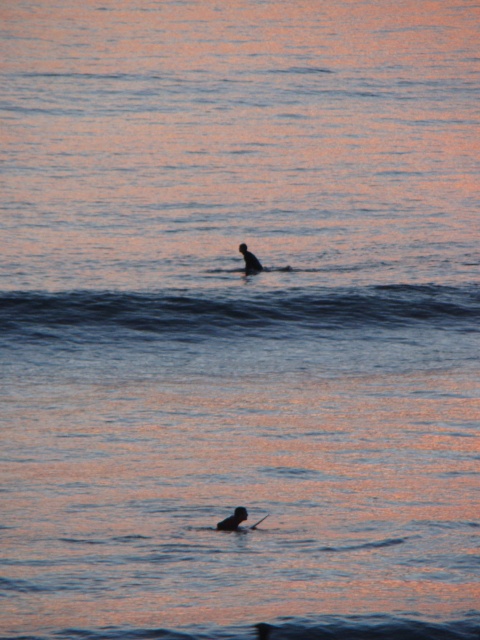
Is silhouette rubber surfboard at lower center wider than silhouette surfboard at center?

No, silhouette rubber surfboard at lower center is not wider than silhouette surfboard at center.

Does point (242, 520) come in front of point (256, 268)?

Yes, it is in front of point (256, 268).

I want to click on silhouette rubber surfboard at lower center, so click(x=232, y=518).

Who is more distant from viewer, (240, 248) or (253, 529)?

The point (240, 248) is behind.

I want to click on silhouette surfboard at center, so click(x=250, y=259).

Where is `silhouette surfboard at center`? This screenshot has width=480, height=640. silhouette surfboard at center is located at coordinates (250, 259).

This screenshot has width=480, height=640. In order to click on silhouette surfboard at center in this screenshot , I will do `click(250, 259)`.

Does silhouette rubber surfboard at lower center have a greater height compared to smooth black paddle at lower center?

Correct, silhouette rubber surfboard at lower center is much taller as smooth black paddle at lower center.

Can you confirm if silhouette rubber surfboard at lower center is smaller than smooth black paddle at lower center?

No.

Measure the distance between point (235, 518) and camera.

Point (235, 518) is 52.34 feet away from camera.

Where is `silhouette rubber surfboard at lower center`? This screenshot has height=640, width=480. silhouette rubber surfboard at lower center is located at coordinates point(232,518).